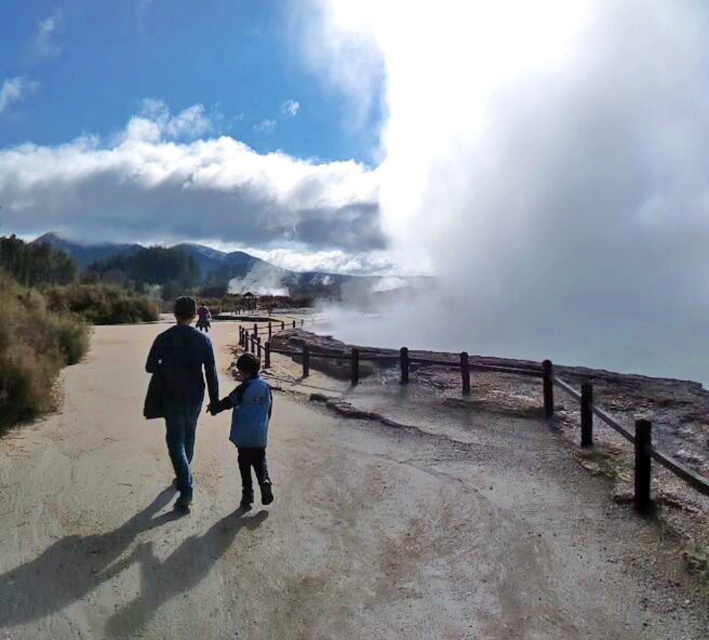
Who is taller, dirt track at center or blue fabric jacket at center?

blue fabric jacket at center is taller.

Does point (364, 474) lie behind point (242, 355)?

That is False.

Is point (277, 580) positioned behind point (259, 417)?

No, (277, 580) is closer to viewer.

This screenshot has height=640, width=709. Find the location of `dirt track at center`. dirt track at center is located at coordinates (316, 525).

Is point (230, 593) farther from viewer compared to point (116, 150)?

That is False.

This screenshot has height=640, width=709. Identify the location of dirt track at center. (316, 525).

This screenshot has width=709, height=640. Identify the location of dirt track at center. (316, 525).

Who is positioned more to the right, white fluffy cloud at upper center or blue fabric jacket at center?

blue fabric jacket at center is more to the right.

Is the position of white fluffy cloud at upper center less distant than that of blue fabric jacket at center?

No, white fluffy cloud at upper center is behind blue fabric jacket at center.

Is point (152, 193) behind point (238, 458)?

Yes, point (152, 193) is farther from viewer.

This screenshot has width=709, height=640. What are the coordinates of `white fluffy cloud at upper center` in the screenshot? It's located at (195, 193).